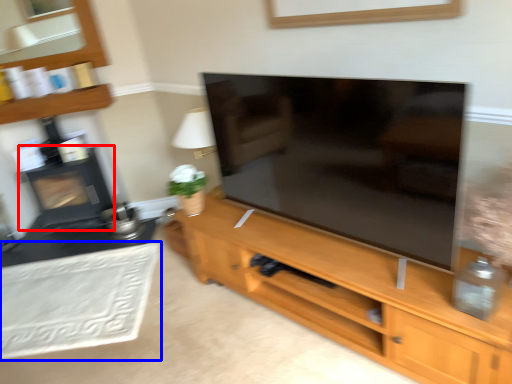
Question: Which point is closer to the camera, fireplace (highlighted by a red box) or plain (highlighted by a blue box)?

Choices:
 (A) fireplace
 (B) plain

Answer: (B)